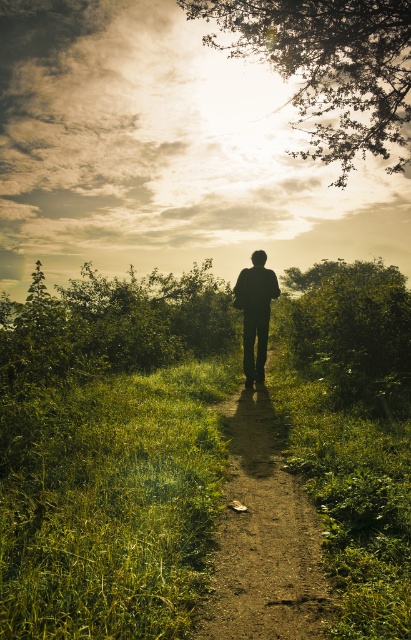
Looking at this image, you are standing at the point labeled point (328, 65) in the image. Looking around, what are you surrounded by?

You are surrounded by silvery metallic branches at upper center.

In the scene shown: You are an artist setting up your easel to paint the scene. You want to ensure the silvery metallic branches at upper center and the dirt path at center are both visible in your painting. Given their relative heights, which object will appear taller in your artwork?

The silvery metallic branches at upper center will appear taller in your artwork since they have a greater height compared to the dirt path at center according to the description.

You are standing at the starting point of the dirt path at center. If you walk straight ahead, will you eventually reach the end of the path or continue infinitely?

The dirt path at center is located at point (263, 538), so walking straight ahead will eventually reach the end of the path.